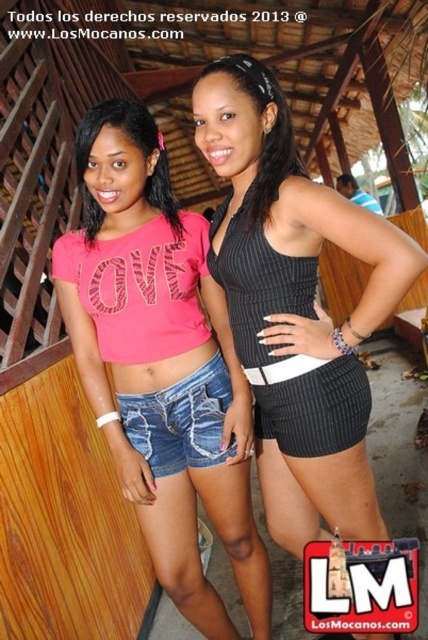
You are at a party and need to find someone wearing a pink matte shirt at upper left. Which direction should you look relative to the black ribbed shorts at center?

The pink matte shirt at upper left is located to the left of the black ribbed shorts at center, so you should look to the left side of the black ribbed shorts at center to find it.

You are at a clothing store and see two items displayed side by side. The items are the black ribbed tank top at center and the black ribbed shorts at center. Which one is positioned to the right?

The black ribbed tank top at center is positioned to the right of the black ribbed shorts at center.